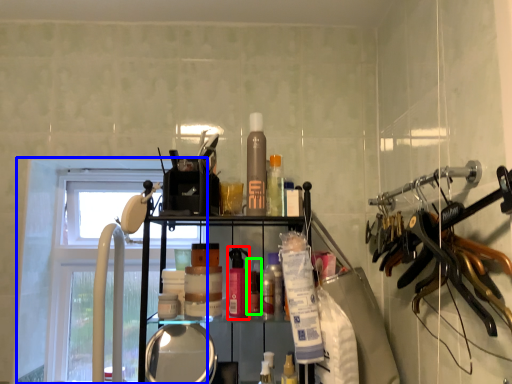
Question: Estimate the real-world distances between objects in this image. Which object is closer to toiletry (highlighted by a red box), window (highlighted by a blue box) or toiletry (highlighted by a green box)?

Choices:
 (A) window
 (B) toiletry

Answer: (B)